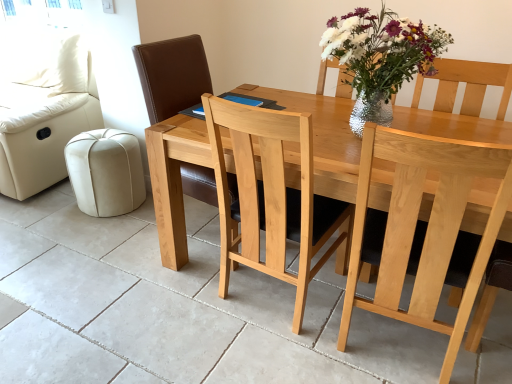
You are a GUI agent. You are given a task and a screenshot of the screen. Output one action in this format:
    pyautogui.click(x=<x>, y=<y>)
    Task: Click on the vacant area situated to the left side of beige leather ottoman at lower left
    Image resolution: width=512 pixels, height=384 pixels.
    Given the screenshot: What is the action you would take?
    pyautogui.click(x=47, y=212)